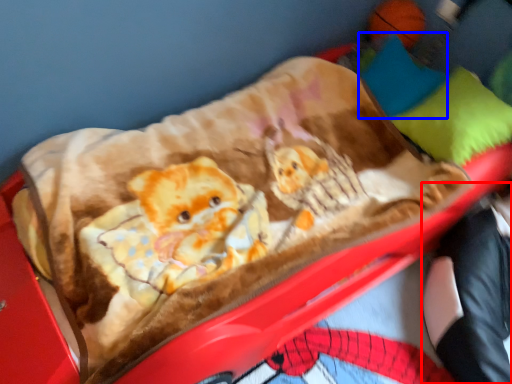
Question: Which of the following is the closest to the observer, couple (highlighted by a red box) or pillow (highlighted by a blue box)?

Choices:
 (A) couple
 (B) pillow

Answer: (A)